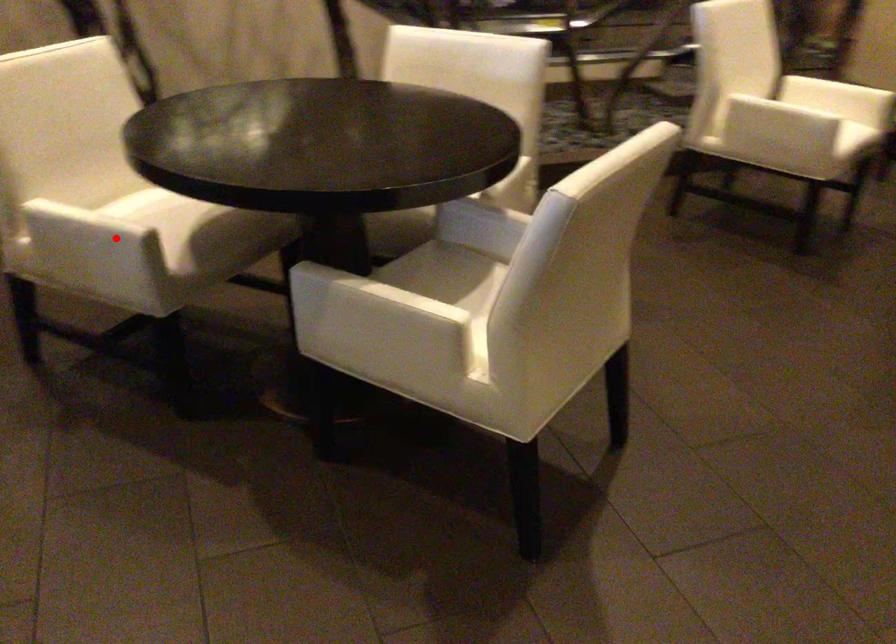
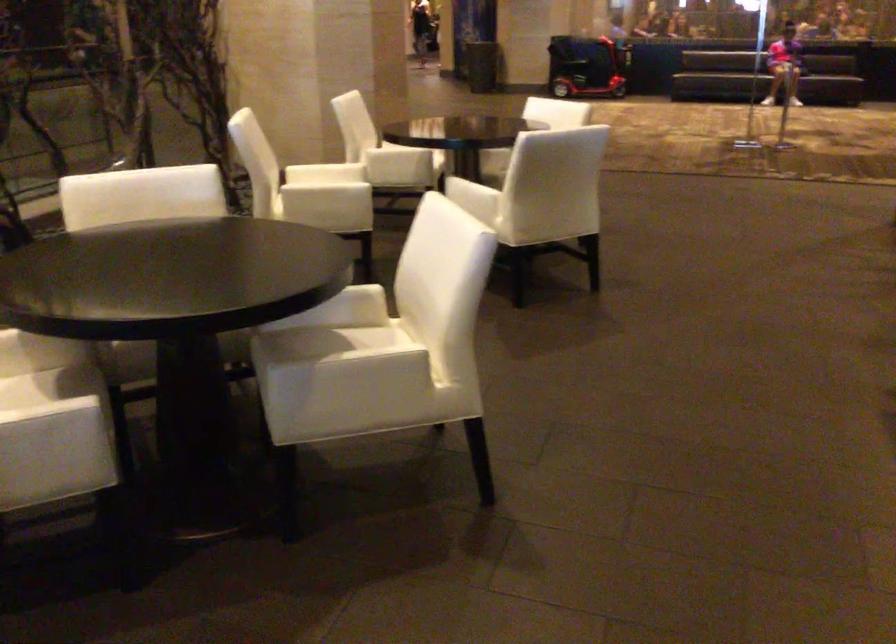
The point at the highlighted location is marked in the first image. Where is the corresponding point in the second image?

(56, 422)